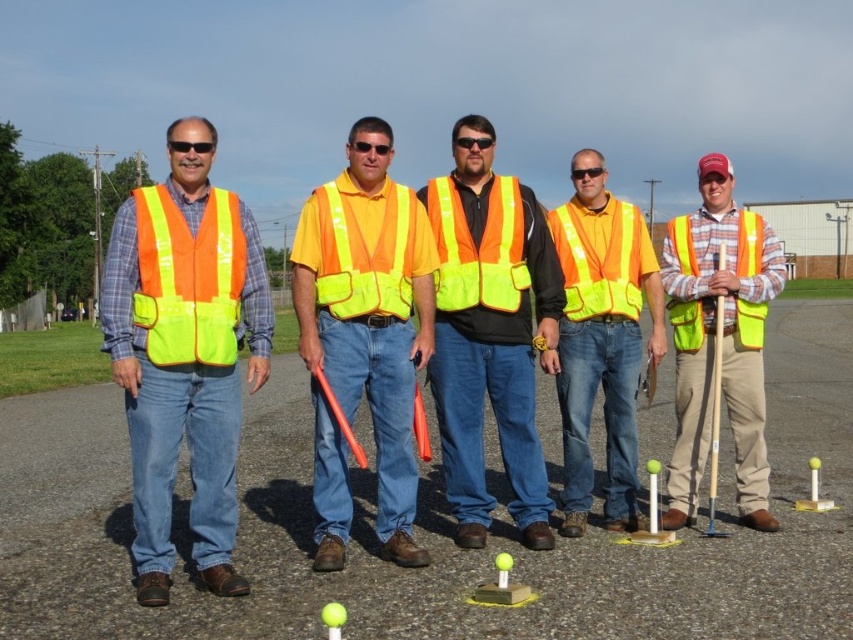
Is high visibility vest at center taller than matte yellow vest at right?

Incorrect, high visibility vest at center's height is not larger of matte yellow vest at right's.

Does point (482, 470) come in front of point (666, 285)?

Yes, it is.

Where is `high visibility vest at center`? This screenshot has height=640, width=853. high visibility vest at center is located at coordinates (489, 332).

Measure the distance between matte orange safety vest at center and high-visibility fabric safety vest at center.

matte orange safety vest at center and high-visibility fabric safety vest at center are 5.99 feet apart.

Find the location of a particular element. matte orange safety vest at center is located at coordinates (601, 339).

Find the location of a particular element. The height and width of the screenshot is (640, 853). matte orange safety vest at center is located at coordinates (601, 339).

In the scene shown: Can you confirm if hi-visibility reflective vest at left is positioned below matte yellow vest at right?

Yes, hi-visibility reflective vest at left is below matte yellow vest at right.

Which is below, hi-visibility reflective vest at left or matte yellow vest at right?

Positioned lower is hi-visibility reflective vest at left.

Is point (138, 513) positioned in front of point (718, 218)?

Yes, point (138, 513) is in front of point (718, 218).

You are a GUI agent. You are given a task and a screenshot of the screen. Output one action in this format:
    pyautogui.click(x=<x>, y=<y>)
    Task: Click on the hi-visibility reflective vest at left
    Image resolution: width=853 pixels, height=640 pixels.
    Given the screenshot: What is the action you would take?
    (184, 353)